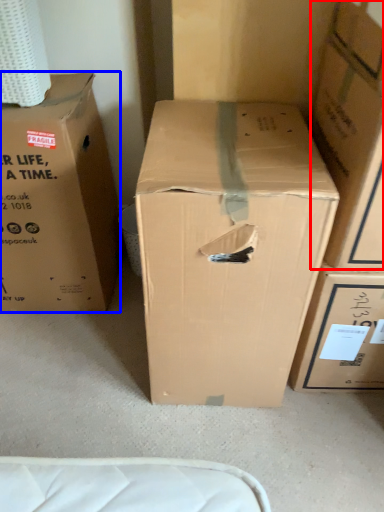
Question: Which object appears closest to the camera in this image, box (highlighted by a red box) or box (highlighted by a blue box)?

Choices:
 (A) box
 (B) box

Answer: (A)